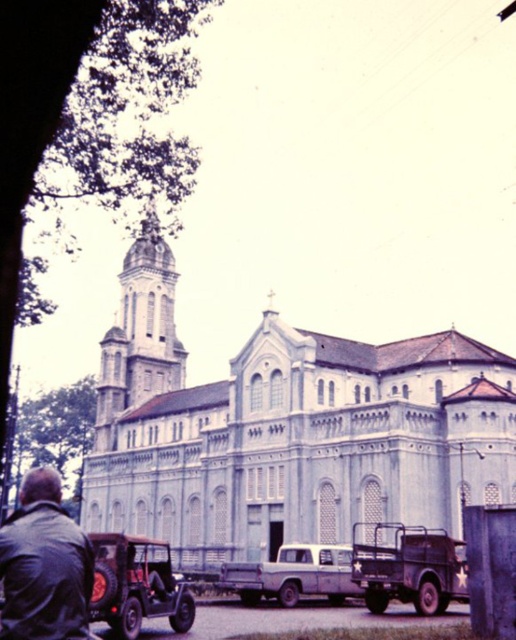
In the scene shown: Between light gray stone church at center and rustic brown jeep at lower left, which one appears on the left side from the viewer's perspective?

Positioned to the left is rustic brown jeep at lower left.

Which of these two, light gray stone church at center or rustic brown jeep at lower left, stands taller?

With more height is light gray stone church at center.

Describe the element at coordinates (287, 432) in the screenshot. I see `light gray stone church at center` at that location.

The width and height of the screenshot is (516, 640). Identify the location of light gray stone church at center. (287, 432).

Which is more to the left, light gray stone church at center or matte gray truck at center?

light gray stone church at center is more to the left.

Consider the image. Can you confirm if light gray stone church at center is positioned above matte gray truck at center?

Yes.

The image size is (516, 640). Describe the element at coordinates (287, 432) in the screenshot. I see `light gray stone church at center` at that location.

The image size is (516, 640). What are the coordinates of `light gray stone church at center` in the screenshot? It's located at (287, 432).

Does light gray stone church at center appear on the left side of brown leather jacket at lower left?

In fact, light gray stone church at center is to the right of brown leather jacket at lower left.

Who is positioned more to the left, light gray stone church at center or brown leather jacket at lower left?

brown leather jacket at lower left

Is point (233, 472) more distant than point (50, 566)?

Yes, point (233, 472) is farther from viewer.

Where is `light gray stone church at center`? This screenshot has height=640, width=516. light gray stone church at center is located at coordinates [287, 432].